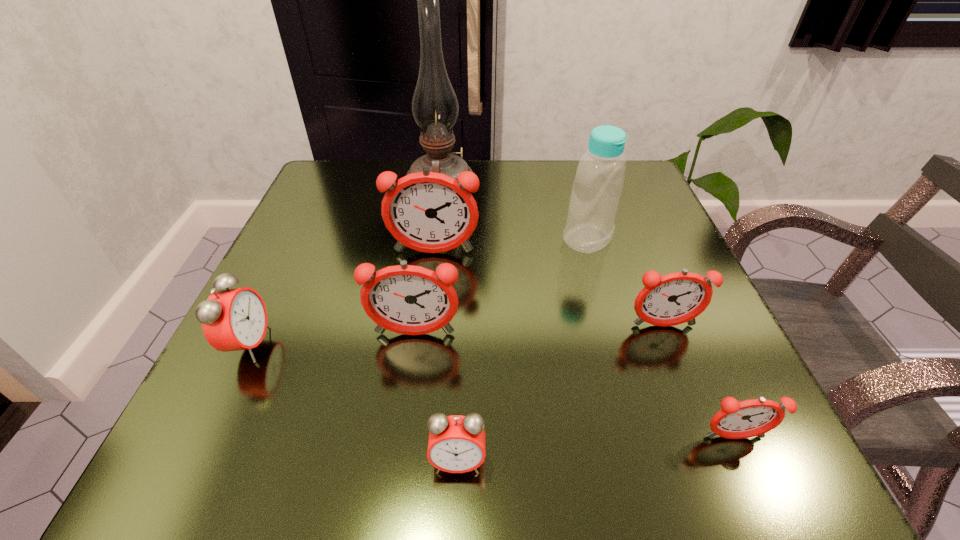
What are the coordinates of `vacant space that satisfies the following two spatial constraints: 1. on the front-facing side of the sixth shortest object; 2. on the front-facing side of the leftmost object` in the screenshot? It's located at (422, 345).

You are a GUI agent. You are given a task and a screenshot of the screen. Output one action in this format:
    pyautogui.click(x=<x>, y=<y>)
    Task: Click on the free space that satisfies the following two spatial constraints: 1. on the front-facing side of the fourth tallest object; 2. on the front-facing side of the left red alarm clock
    This screenshot has width=960, height=540.
    Given the screenshot: What is the action you would take?
    pyautogui.click(x=413, y=345)

Where is `blank space that satisfies the following two spatial constraints: 1. on the front-facing side of the tallest alarm clock; 2. on the front-facing side of the leftmost alarm clock`? The height and width of the screenshot is (540, 960). blank space that satisfies the following two spatial constraints: 1. on the front-facing side of the tallest alarm clock; 2. on the front-facing side of the leftmost alarm clock is located at coordinates (422, 345).

The height and width of the screenshot is (540, 960). Identify the location of free space that satisfies the following two spatial constraints: 1. on the front-facing side of the second smallest reddish-pink alarm clock; 2. on the front-facing side of the farther red alarm clock. (671, 345).